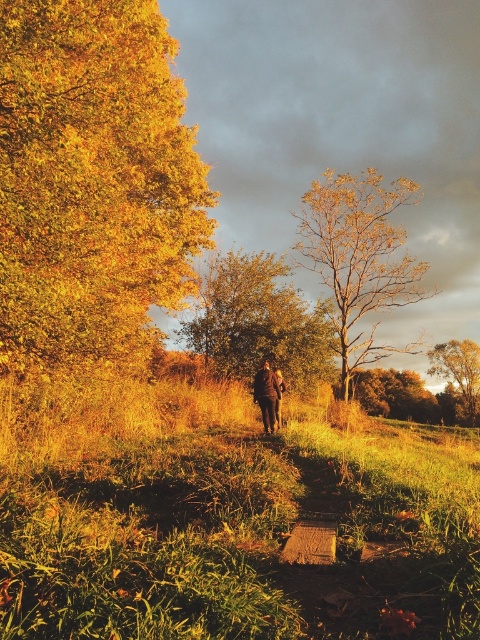
Does point (313, 317) come behind point (472, 344)?

No, it is in front of (472, 344).

Is golden textured tree at center to the right of golden textured tree at upper right from the viewer's perspective?

In fact, golden textured tree at center is to the left of golden textured tree at upper right.

This screenshot has height=640, width=480. In order to click on golden textured tree at center in this screenshot , I will do `click(257, 321)`.

Who is positioned more to the right, brown textured tree at center or golden textured tree at upper right?

Positioned to the right is golden textured tree at upper right.

Who is more distant from viewer, (400, 196) or (474, 417)?

Positioned behind is point (474, 417).

Which is behind, point (349, 307) or point (478, 387)?

The point (478, 387) is more distant.

Where is `brown textured tree at center`? brown textured tree at center is located at coordinates (360, 257).

Based on the photo, which is above, golden leafy tree at left or golden textured tree at upper right?

golden leafy tree at left

Can you confirm if golden leafy tree at left is positioned below golden textured tree at upper right?

No, golden leafy tree at left is not below golden textured tree at upper right.

Consider the image. Who is more distant from viewer, (154,116) or (433,358)?

The point (433,358) is more distant.

You are a GUI agent. You are given a task and a screenshot of the screen. Output one action in this format:
    pyautogui.click(x=<x>, y=<y>)
    Task: Click on the golden leafy tree at left
    
    Given the screenshot: What is the action you would take?
    pyautogui.click(x=93, y=182)